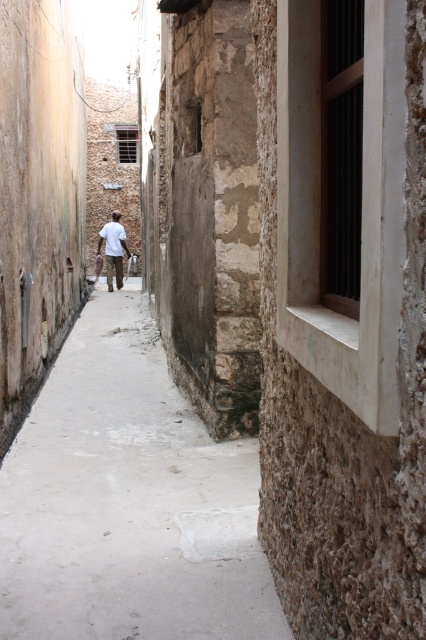
Does smooth concrete pavement at center have a greater height compared to white matte shirt at center?

No.

Between smooth concrete pavement at center and white matte shirt at center, which one has less height?

With less height is smooth concrete pavement at center.

Is point (118, 352) behind point (111, 276)?

That is False.

I want to click on smooth concrete pavement at center, so click(x=127, y=500).